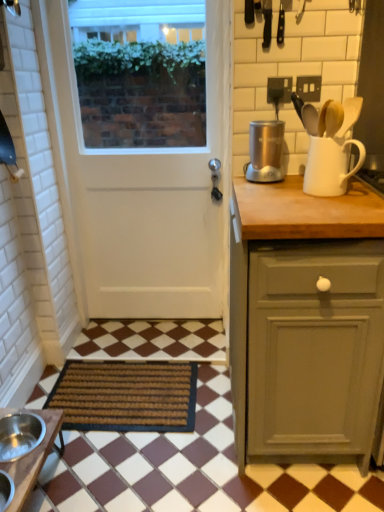
The width and height of the screenshot is (384, 512). I want to click on free space above brown woven mat at lower left (from a real-world perspective), so click(111, 382).